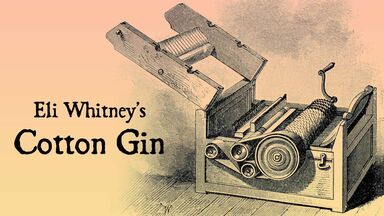
Image resolution: width=384 pixels, height=216 pixels. In order to click on wall in this screenshot , I will do `click(309, 45)`, `click(91, 79)`, `click(92, 176)`.